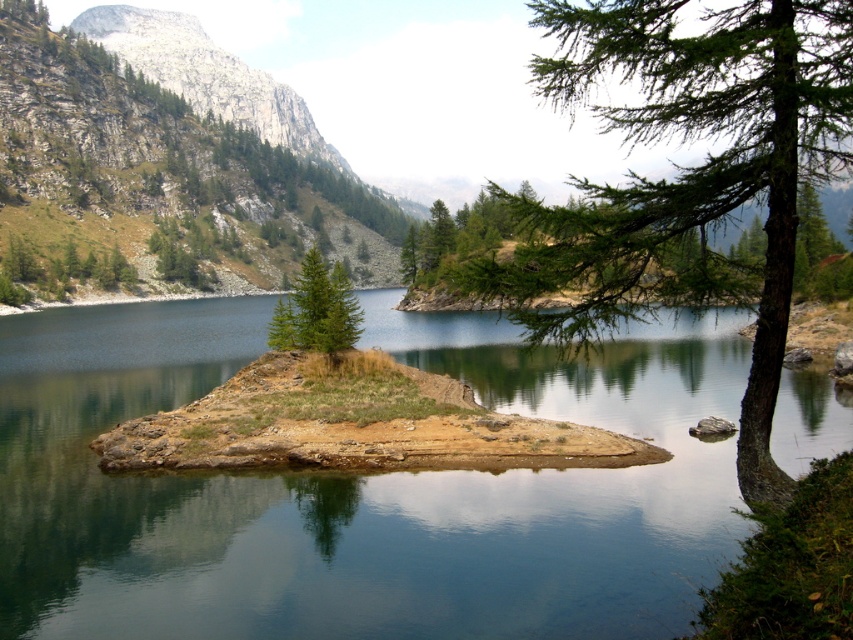
Question: Is green grassy island at center above rocky gray mountain at upper left?

Choices:
 (A) yes
 (B) no

Answer: (B)

Question: Which point is closer to the camera?

Choices:
 (A) (310, 308)
 (B) (607, 561)

Answer: (B)

Question: Is green needle-like tree at right thinner than green needle-like tree at center?

Choices:
 (A) no
 (B) yes

Answer: (A)

Question: Among these points, which one is nearest to the camera?

Choices:
 (A) (312, 264)
 (B) (589, 234)
 (C) (164, 49)

Answer: (B)

Question: Does green grassy island at center have a lesser width compared to green needle-like tree at center?

Choices:
 (A) yes
 (B) no

Answer: (B)

Question: Among these points, which one is farthest from the camera?

Choices:
 (A) (328, 548)
 (B) (553, 268)
 (C) (274, 340)
 (D) (227, 60)

Answer: (D)